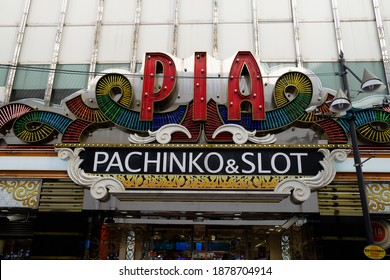
Where is `tvs`? Image resolution: width=390 pixels, height=280 pixels. tvs is located at coordinates (168, 246), (181, 244), (216, 246).